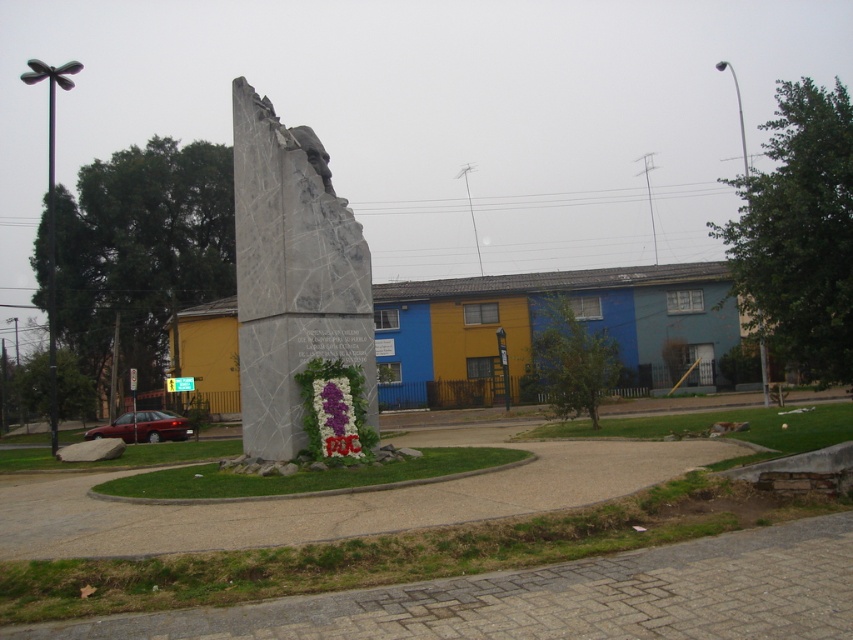
Where is `gray marble statue at center`? gray marble statue at center is located at coordinates (292, 275).

Between gray marble statue at center and purple fabric flower at center, which one is positioned higher?

gray marble statue at center is above.

The height and width of the screenshot is (640, 853). Identify the location of gray marble statue at center. (292, 275).

You are a GUI agent. You are given a task and a screenshot of the screen. Output one action in this format:
    pyautogui.click(x=<x>, y=<y>)
    Task: Click on the gray marble statue at center
    
    Given the screenshot: What is the action you would take?
    pyautogui.click(x=292, y=275)